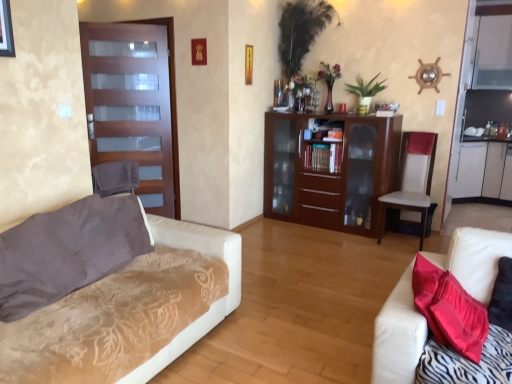
Question: Is white textured couch at left, placed as the second studio couch when sorted from right to left, aimed at matte glass door at left?

Choices:
 (A) no
 (B) yes

Answer: (A)

Question: Is white textured couch at left, which ranks as the 1th studio couch in left-to-right order, closer to camera compared to matte glass door at left?

Choices:
 (A) yes
 (B) no

Answer: (A)

Question: From the image's perspective, is white textured couch at left, placed as the second studio couch when sorted from right to left, on top of matte glass door at left?

Choices:
 (A) yes
 (B) no

Answer: (B)

Question: Is white textured couch at left, placed as the second studio couch when sorted from right to left, not close to matte glass door at left?

Choices:
 (A) yes
 (B) no

Answer: (A)

Question: Does white textured couch at left, placed as the second studio couch when sorted from right to left, come behind matte glass door at left?

Choices:
 (A) no
 (B) yes

Answer: (A)

Question: Based on their positions, is metallic gold picture frame at upper center, arranged as the 2th picture frame when viewed from the left, located to the left or right of matte glass door at left?

Choices:
 (A) right
 (B) left

Answer: (A)

Question: From their relative heights in the image, would you say metallic gold picture frame at upper center, arranged as the 2th picture frame when viewed from the left, is taller or shorter than matte glass door at left?

Choices:
 (A) short
 (B) tall

Answer: (A)

Question: From a real-world perspective, is metallic gold picture frame at upper center, arranged as the 2th picture frame when viewed from the left, above or below matte glass door at left?

Choices:
 (A) below
 (B) above

Answer: (B)

Question: Considering their positions, is metallic gold picture frame at upper center, the 2th picture frame from the front, located in front of or behind matte glass door at left?

Choices:
 (A) behind
 (B) front

Answer: (A)

Question: Is velvet brown pillow at left in front of or behind brown wood cabinet at center in the image?

Choices:
 (A) behind
 (B) front

Answer: (B)

Question: Is velvet brown pillow at left bigger or smaller than brown wood cabinet at center?

Choices:
 (A) small
 (B) big

Answer: (A)

Question: From a real-world perspective, is velvet brown pillow at left above or below brown wood cabinet at center?

Choices:
 (A) below
 (B) above

Answer: (B)

Question: Considering the positions of point (42, 284) and point (332, 145), is point (42, 284) closer or farther from the camera than point (332, 145)?

Choices:
 (A) closer
 (B) farther

Answer: (A)

Question: Based on their positions, is metallic gold picture frame at upper center, the 2th picture frame from the front, located to the left or right of brown wood cabinet at center?

Choices:
 (A) left
 (B) right

Answer: (A)

Question: In terms of width, does metallic gold picture frame at upper center, the first picture frame when ordered from right to left, look wider or thinner when compared to brown wood cabinet at center?

Choices:
 (A) thin
 (B) wide

Answer: (A)